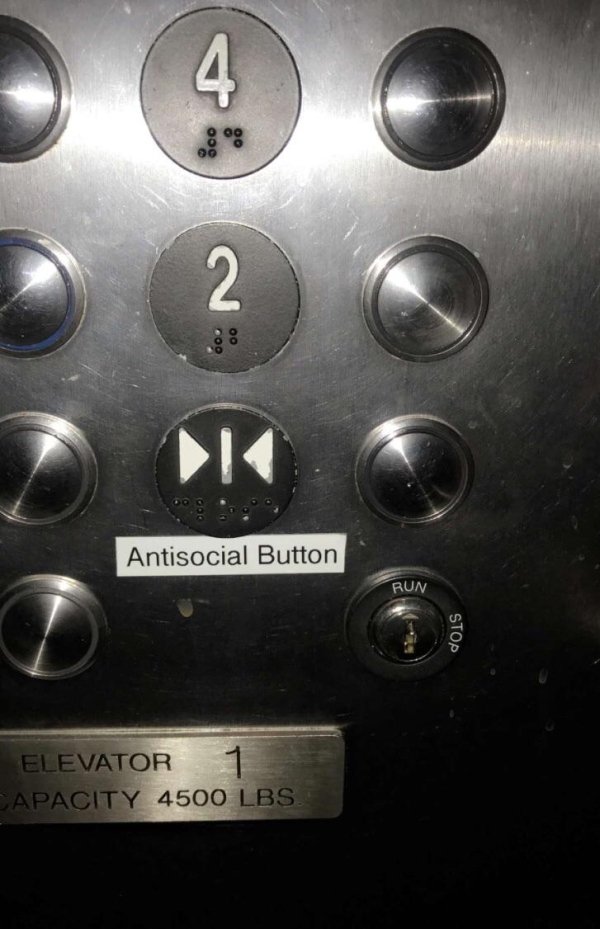
I want to click on sticker, so click(269, 567).